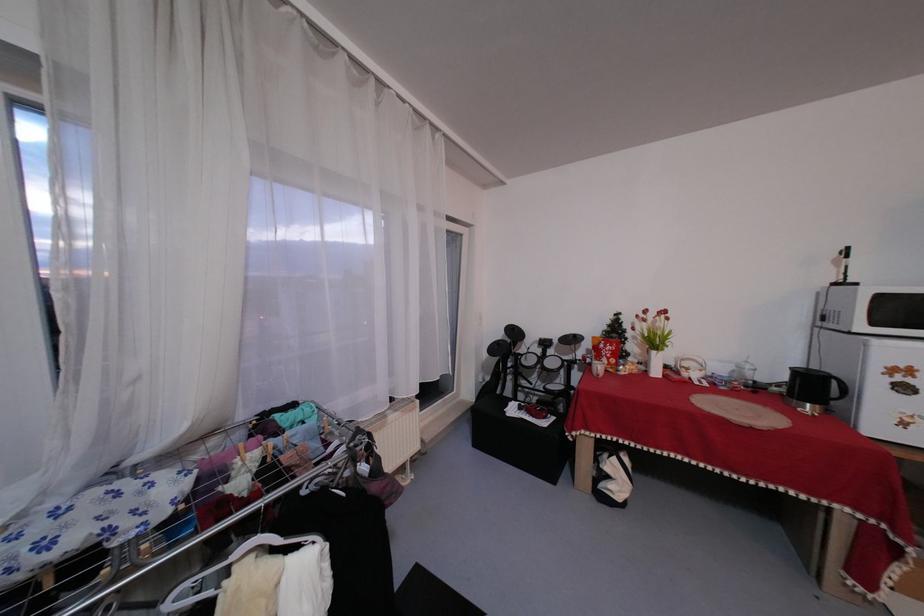
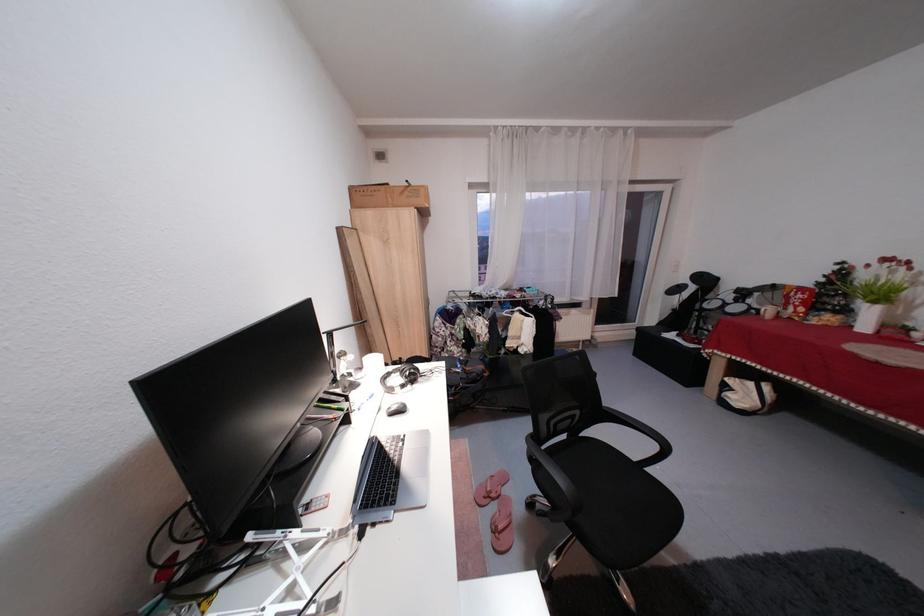
Locate, in the second image, the point that corresponds to (617,371) in the first image.

(800, 320)